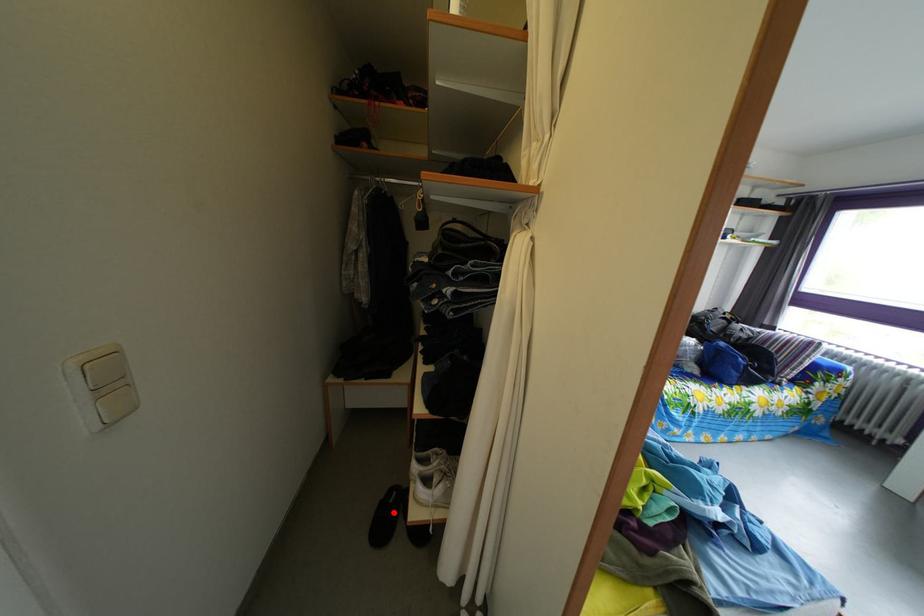
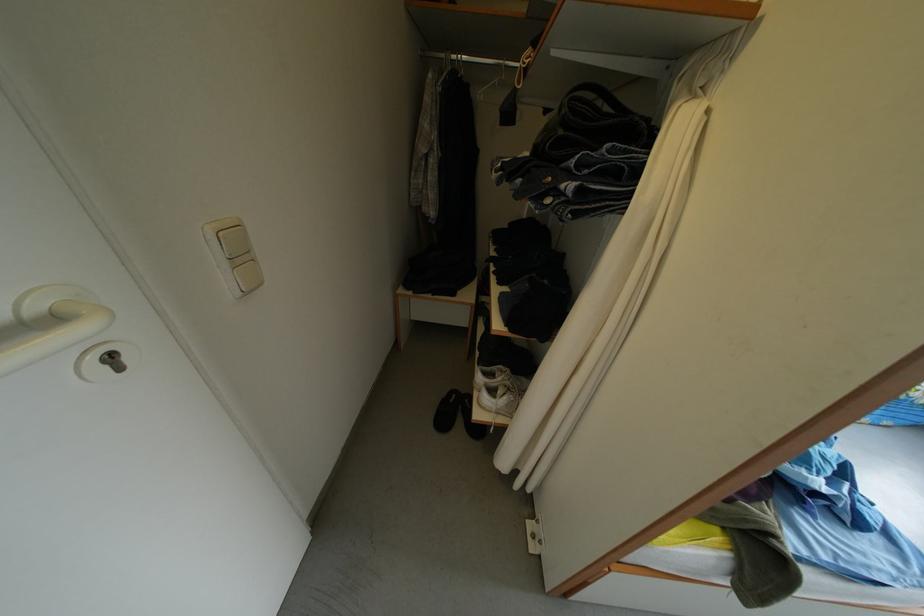
Question: I am providing you with two images of the same scene from different viewpoints. Image1 has a red point marked. In image2, the corresponding 3D location appears at what relative position? Reply with the corresponding letter.

Choices:
 (A) Closer
 (B) Farther

Answer: (A)